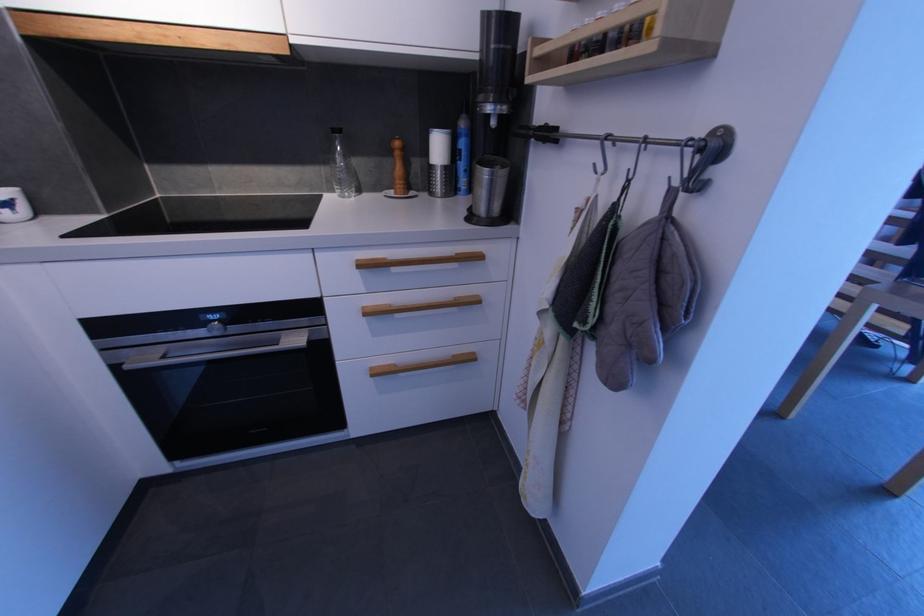
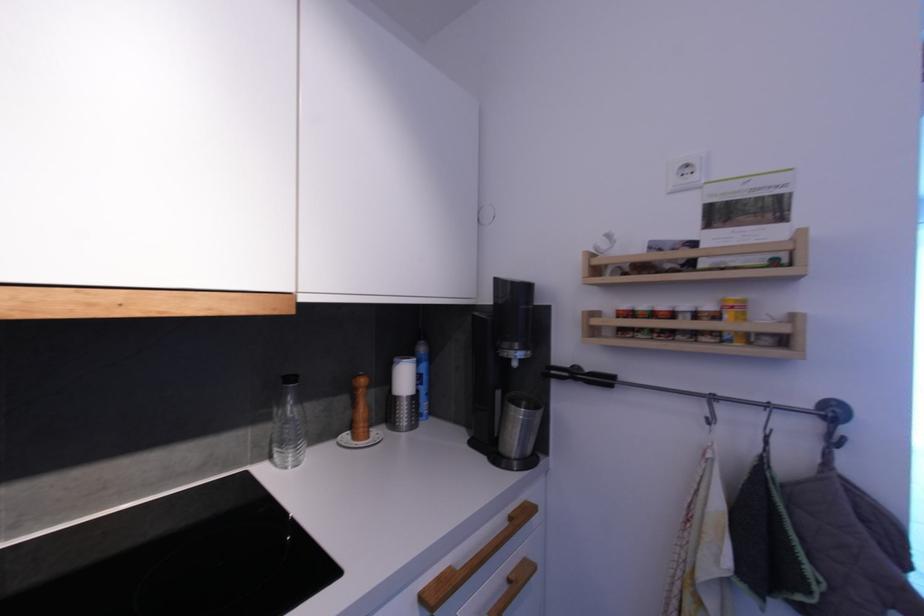
Where in the second image is the point corresponding to point 483,168 from the first image?

(517, 408)